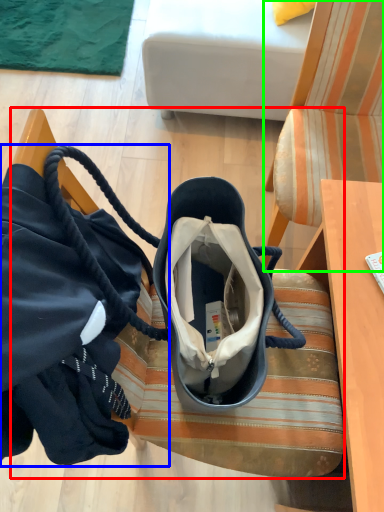
Question: Which object is the closest to the furniture (highlighted by a red box)? Choose among these: handbag (highlighted by a blue box) or chair (highlighted by a green box).

Choices:
 (A) handbag
 (B) chair

Answer: (A)